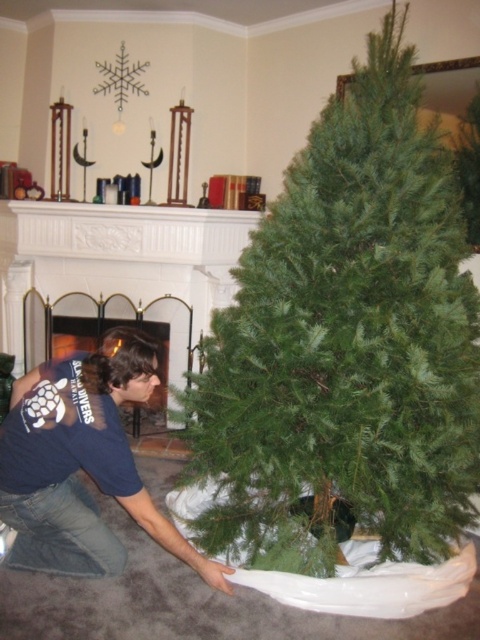
Who is shorter, green matte christmas tree at center or green needle-like at center?

green needle-like at center is shorter.

Is point (361, 108) closer to camera compared to point (464, 145)?

Yes, it is in front of point (464, 145).

Describe the element at coordinates (347, 342) in the screenshot. I see `green matte christmas tree at center` at that location.

This screenshot has width=480, height=640. I want to click on green matte christmas tree at center, so click(347, 342).

Who is more forward, [7,483] or [471,227]?

Point [7,483] is in front.

Identify the location of dark blue t-shirt at lower left. (82, 461).

How far apart are matte white fireplace at center and green needle-like at center?

matte white fireplace at center and green needle-like at center are 2.12 meters apart.

Is matte white fireplace at center below green needle-like at center?

Yes, matte white fireplace at center is below green needle-like at center.

Is point (80, 317) more distant than point (467, 120)?

Yes, point (80, 317) is behind point (467, 120).

In order to click on matte white fireplace at center in this screenshot , I will do `click(101, 340)`.